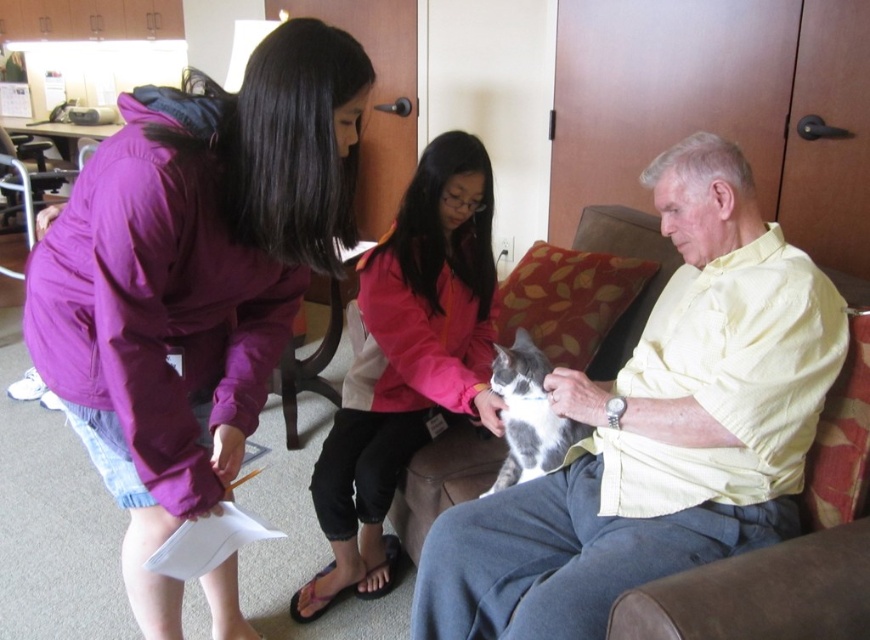
Is light yellow shirt at center above pink fabric jacket at center?

Incorrect, light yellow shirt at center is not positioned above pink fabric jacket at center.

Which of these two, light yellow shirt at center or pink fabric jacket at center, stands taller?

pink fabric jacket at center is taller.

Who is more distant from viewer, [485,516] or [363,448]?

Positioned behind is point [363,448].

At what (x,y) coordinates should I click in order to perform the action: click on light yellow shirt at center. Please return your answer as a coordinate pair (x, y). This screenshot has height=640, width=870. Looking at the image, I should click on (657, 429).

Is purple fabric jacket at upper left bigger than gray-white fur cat at center?

Correct, purple fabric jacket at upper left is larger in size than gray-white fur cat at center.

Who is shorter, purple fabric jacket at upper left or gray-white fur cat at center?

With less height is gray-white fur cat at center.

Where is `purple fabric jacket at upper left`? This screenshot has height=640, width=870. purple fabric jacket at upper left is located at coordinates 193,276.

Which is in front, point (407, 257) or point (517, 416)?

Point (517, 416)

Is the position of pink fabric jacket at center more distant than that of gray-white fur cat at center?

Yes, it is.

Is point (417, 429) less distant than point (531, 436)?

That is False.

Image resolution: width=870 pixels, height=640 pixels. What are the coordinates of `pink fabric jacket at center` in the screenshot? It's located at (407, 362).